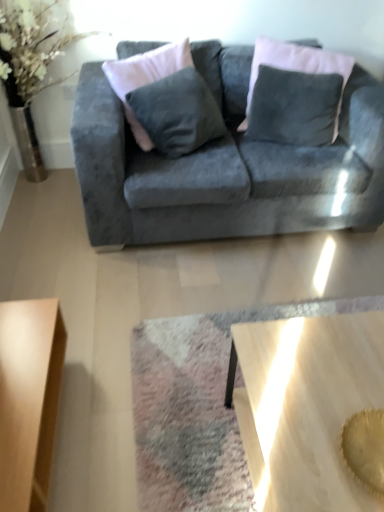
Where is `unoccupied area behind light brown wooden coffee table at lower left, which ranks as the 2th coffee table in right-to-left order`? The width and height of the screenshot is (384, 512). unoccupied area behind light brown wooden coffee table at lower left, which ranks as the 2th coffee table in right-to-left order is located at coordinates (97, 322).